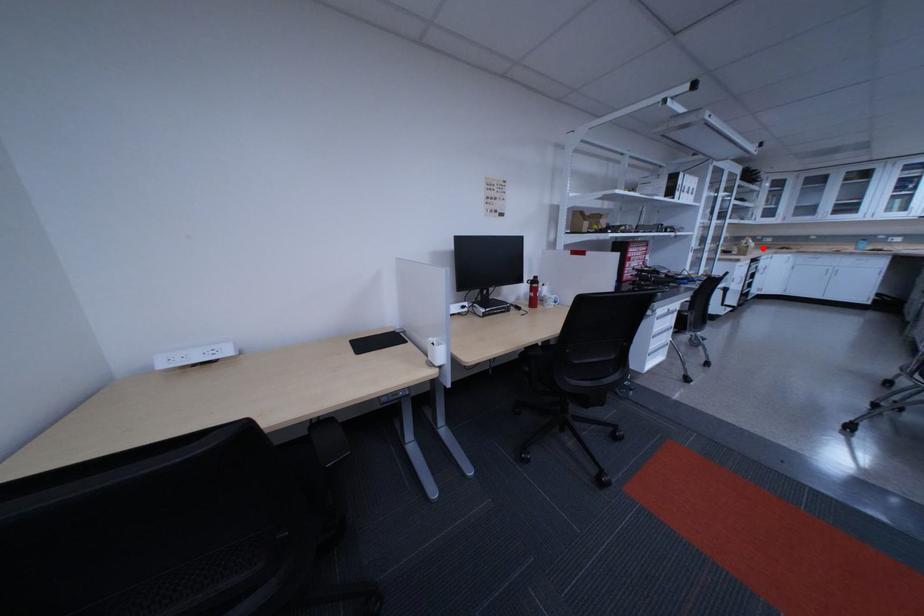
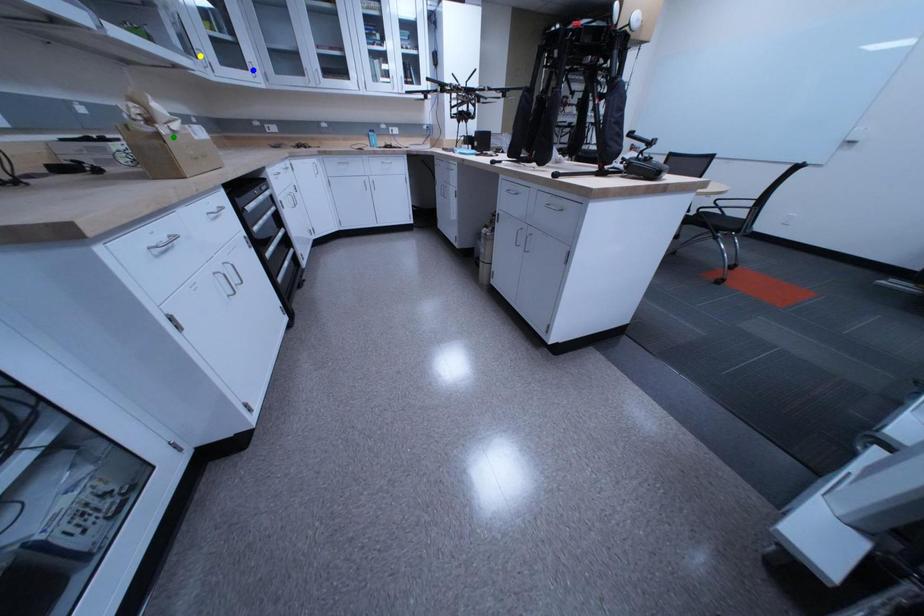
Question: I am providing you with two images of the same scene from different viewpoints. A red point is marked on the first image. You are given multiple points on the second image. Which point in image 2 is actually the same real-world point as the red point in image 1?

Choices:
 (A) blue point
 (B) green point
 (C) yellow point

Answer: (B)